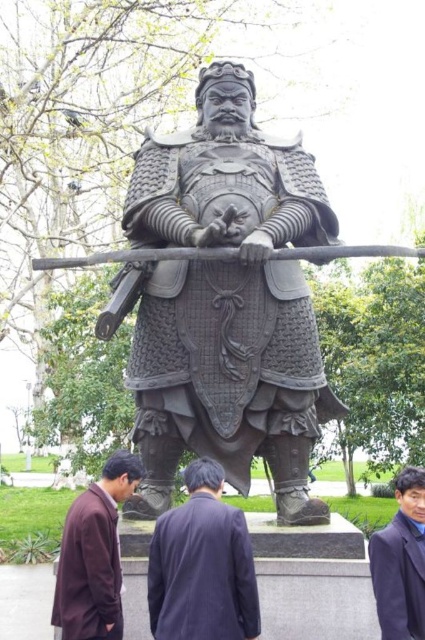
Is brown matte jacket at lower left shorter than dark blue woolen robe at lower right?

No, brown matte jacket at lower left is not shorter than dark blue woolen robe at lower right.

Does point (104, 512) come closer to viewer compared to point (402, 620)?

No, (104, 512) is behind (402, 620).

Identify the location of brown matte jacket at lower left. (95, 554).

Can you confirm if dark brown fabric coat at center is positioned below brown matte jacket at lower left?

Indeed, dark brown fabric coat at center is positioned under brown matte jacket at lower left.

Measure the distance between dark brown fabric coat at center and camera.

dark brown fabric coat at center is 16.51 meters from camera.

Identify the location of dark brown fabric coat at center. This screenshot has height=640, width=425. (201, 564).

Can you confirm if black polished armor at center is positioned to the right of dark blue woolen robe at lower right?

No, black polished armor at center is not to the right of dark blue woolen robe at lower right.

Is black polished armor at center positioned behind dark blue woolen robe at lower right?

Yes.

Image resolution: width=425 pixels, height=640 pixels. What do you see at coordinates (224, 301) in the screenshot?
I see `black polished armor at center` at bounding box center [224, 301].

The width and height of the screenshot is (425, 640). Find the location of `black polished armor at center`. black polished armor at center is located at coordinates (224, 301).